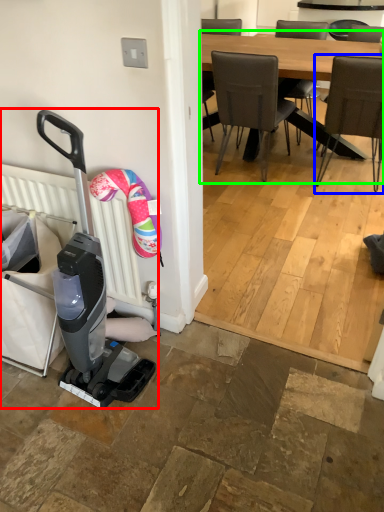
Question: Considering the real-world distances, which object is farthest from baby carriage (highlighted by a red box)? chair (highlighted by a blue box) or kitchen & dining room table (highlighted by a green box)?

Choices:
 (A) chair
 (B) kitchen & dining room table

Answer: (B)